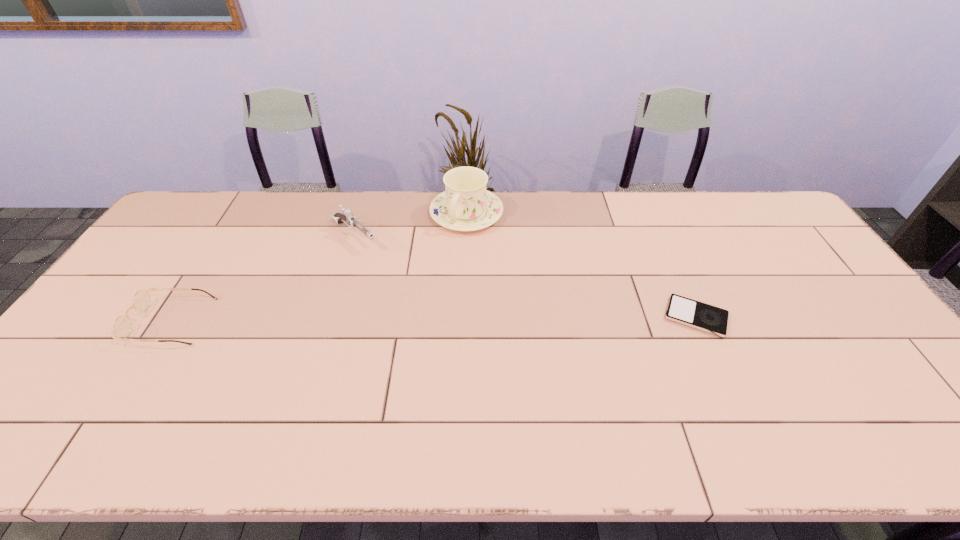
You are a GUI agent. You are given a task and a screenshot of the screen. Output one action in this format:
    pyautogui.click(x=<x>, y=<y>)
    Task: Click on the spectacles
    This screenshot has width=960, height=540.
    Given the screenshot: What is the action you would take?
    pyautogui.click(x=122, y=328)

Where is `the leftmost object`? The width and height of the screenshot is (960, 540). the leftmost object is located at coordinates (122, 328).

Locate an element on the screen. This screenshot has height=540, width=960. the rightmost object is located at coordinates [682, 310].

This screenshot has height=540, width=960. I want to click on iPod, so click(x=682, y=310).

You are a GUI agent. You are given a task and a screenshot of the screen. Output one action in this format:
    pyautogui.click(x=<x>, y=<y>)
    Task: Click on the second object from left to right
    Image resolution: width=960 pixels, height=540 pixels.
    Given the screenshot: What is the action you would take?
    pyautogui.click(x=347, y=217)

Image resolution: width=960 pixels, height=540 pixels. What are the coordinates of `gun` in the screenshot? It's located at (347, 217).

At what (x,y) coordinates should I click in order to perform the action: click on the second object from right to left. Please return your answer as a coordinate pair (x, y). The height and width of the screenshot is (540, 960). Looking at the image, I should click on (466, 205).

Identify the location of the tallest object. (466, 205).

Find the location of a particular element. Image resolution: width=960 pixels, height=540 pixels. vacant region located 0.260m on the right of the rightmost object is located at coordinates (822, 317).

Locate an element on the screen. Image resolution: width=960 pixels, height=540 pixels. free space located 0.150m aimed along the barrel of the gun is located at coordinates (397, 272).